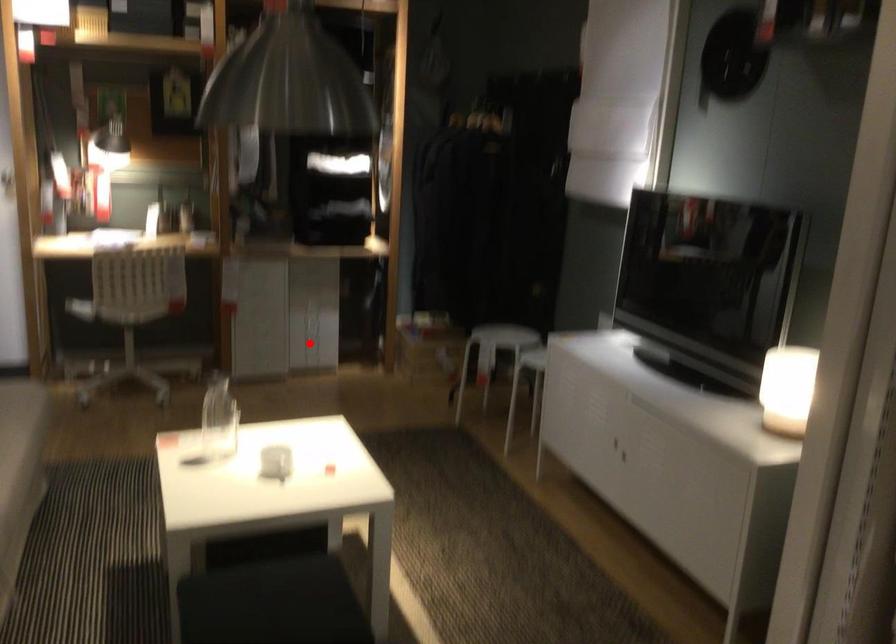
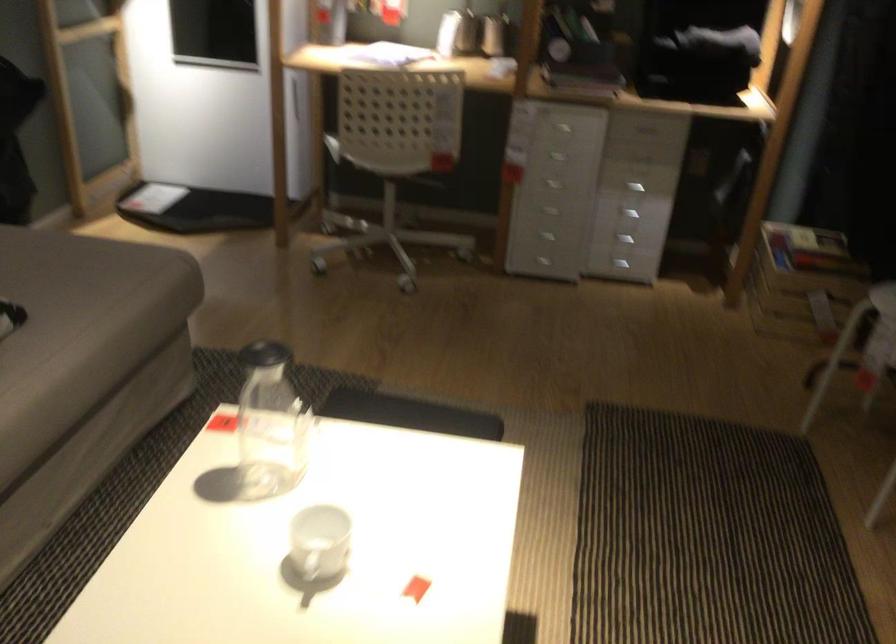
Where in the second image is the point corresponding to the highlighted location from the first image?

(625, 240)